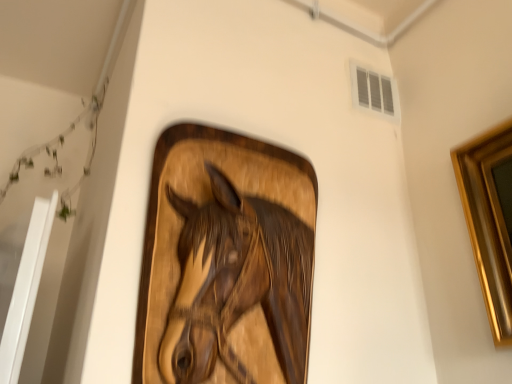
Question: Is wooden horse at center bigger or smaller than white plastic vent at upper right?

Choices:
 (A) big
 (B) small

Answer: (A)

Question: Considering the relative positions of wooden horse at center and white plastic vent at upper right in the image provided, is wooden horse at center to the left or to the right of white plastic vent at upper right?

Choices:
 (A) right
 (B) left

Answer: (B)

Question: Considering the positions of point (279, 299) and point (394, 94), is point (279, 299) closer or farther from the camera than point (394, 94)?

Choices:
 (A) farther
 (B) closer

Answer: (B)

Question: From a real-world perspective, is white plastic vent at upper right physically located above or below wooden horse at center?

Choices:
 (A) above
 (B) below

Answer: (A)

Question: Is white plastic vent at upper right inside or outside of wooden horse at center?

Choices:
 (A) outside
 (B) inside

Answer: (A)

Question: Based on their sizes in the image, would you say white plastic vent at upper right is bigger or smaller than wooden horse at center?

Choices:
 (A) small
 (B) big

Answer: (A)

Question: Is point (359, 69) positioned closer to the camera than point (288, 254)?

Choices:
 (A) farther
 (B) closer

Answer: (A)